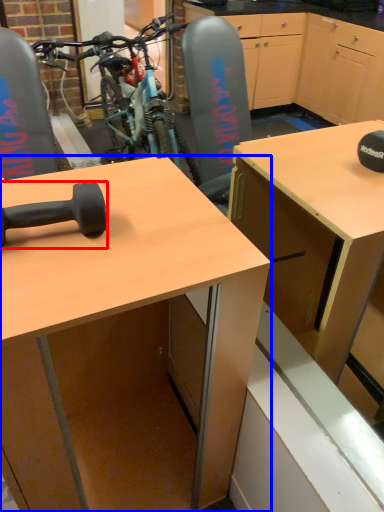
Question: Which object is further to the camera taking this photo, dumbbell (highlighted by a red box) or desk (highlighted by a blue box)?

Choices:
 (A) dumbbell
 (B) desk

Answer: (A)